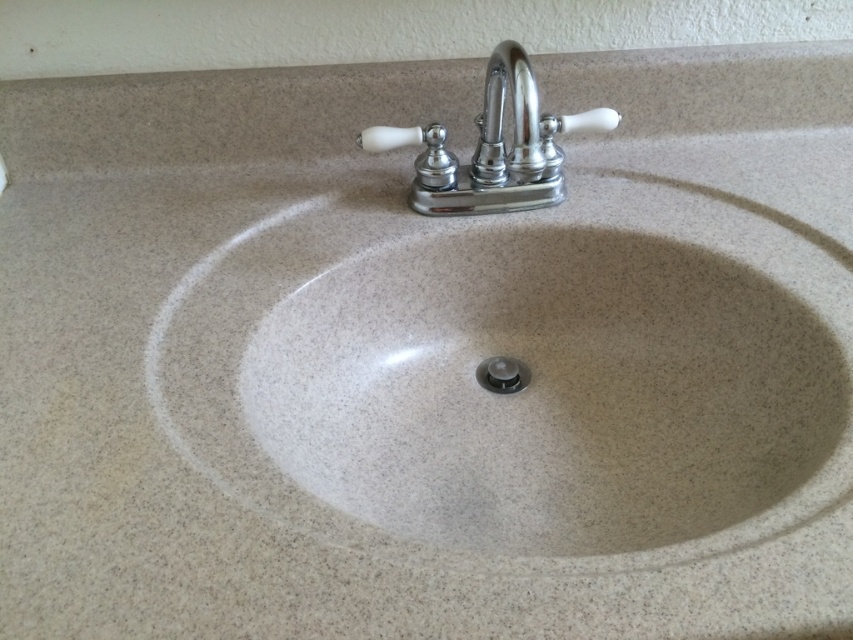
Question: Which point is farther from the camera taking this photo?

Choices:
 (A) (521, 68)
 (B) (515, 68)

Answer: (A)

Question: Among these objects, which one is farthest from the camera?

Choices:
 (A) chrome/polished metal faucet at upper center
 (B) polished chrome faucet at upper center

Answer: (B)

Question: Where is chrome/polished metal faucet at upper center located in relation to polished chrome faucet at upper center in the image?

Choices:
 (A) above
 (B) below

Answer: (B)

Question: Where is chrome/polished metal faucet at upper center located in relation to polished chrome faucet at upper center in the image?

Choices:
 (A) below
 (B) above

Answer: (A)

Question: Does chrome/polished metal faucet at upper center appear on the left side of polished chrome faucet at upper center?

Choices:
 (A) yes
 (B) no

Answer: (A)